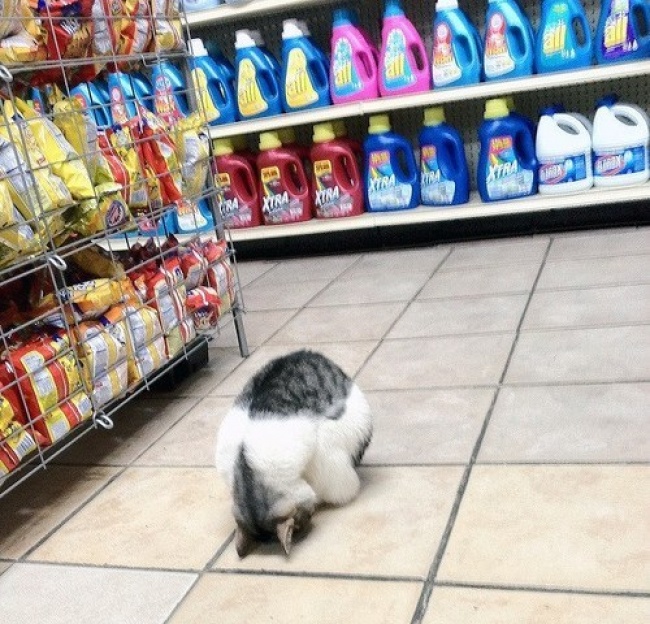
The height and width of the screenshot is (624, 650). In order to click on shelf in this screenshot , I will do `click(140, 195)`.